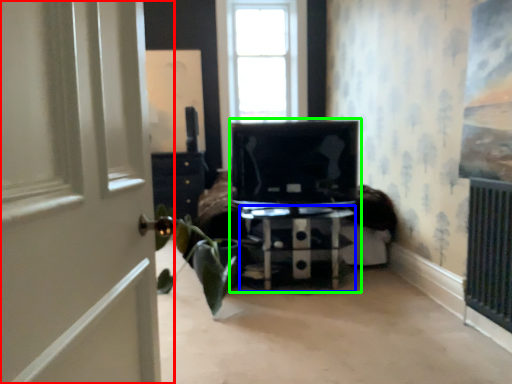
Question: Which object is positioned farthest from door (highlighted by a red box)? Select from furniture (highlighted by a blue box) and entertainment center (highlighted by a green box).

Choices:
 (A) furniture
 (B) entertainment center

Answer: (A)